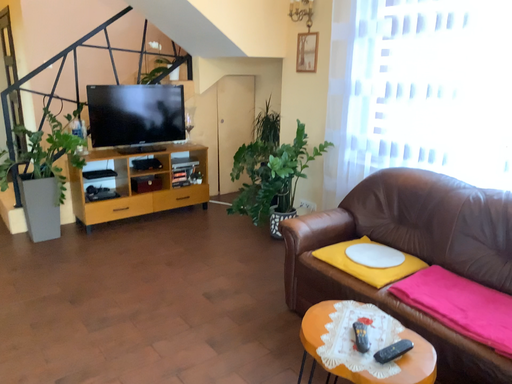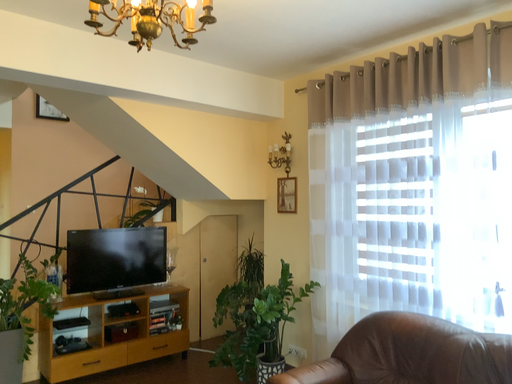
Question: How did the camera likely rotate when shooting the video?

Choices:
 (A) rotated downward
 (B) rotated upward

Answer: (B)